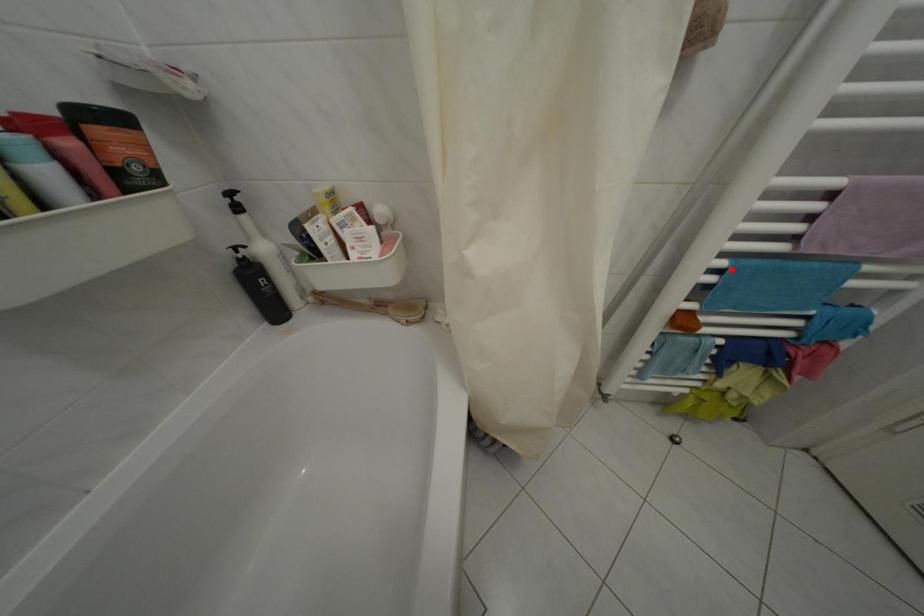
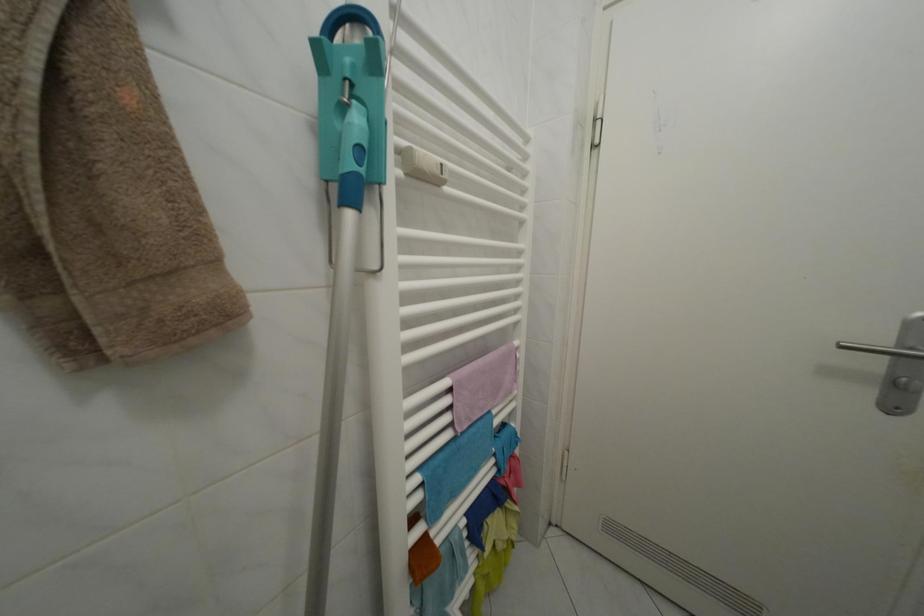
Find the pixel in the second image that matches the highlighted location in the first image.

(427, 485)